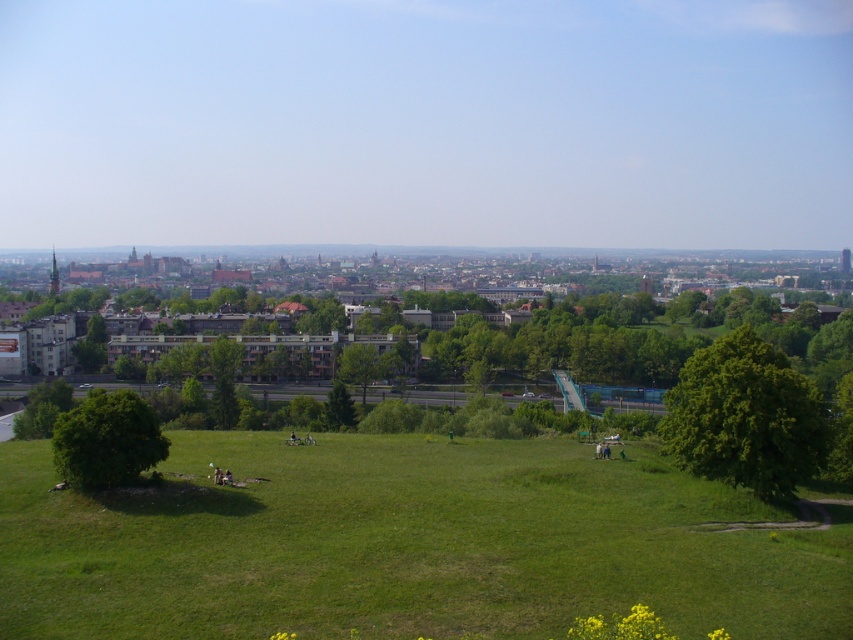
Question: Based on their relative distances, which object is nearer to the green leafy tree at center?

Choices:
 (A) green leafy tree at lower left
 (B) green grassy field at center
 (C) green leafy tree at center-right

Answer: (C)

Question: Is green grassy field at center to the right of green leafy tree at center-right from the viewer's perspective?

Choices:
 (A) no
 (B) yes

Answer: (A)

Question: Does green leafy tree at lower left appear under green leafy tree at center?

Choices:
 (A) no
 (B) yes

Answer: (A)

Question: Which object appears farthest from the camera in this image?

Choices:
 (A) green leafy tree at center
 (B) green grassy field at center
 (C) green leafy tree at center-right
 (D) green leafy tree at lower left

Answer: (A)

Question: Where is green grassy field at center located in relation to green leafy tree at center-right in the image?

Choices:
 (A) below
 (B) above

Answer: (A)

Question: Which point appears closest to the camera in this image?

Choices:
 (A) (155, 419)
 (B) (47, 451)

Answer: (A)